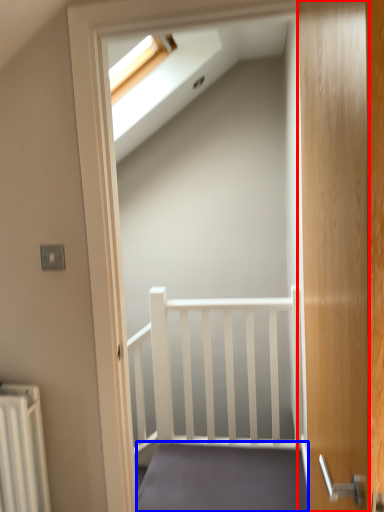
Question: Which object appears closest to the camera in this image, door (highlighted by a red box) or stairs (highlighted by a blue box)?

Choices:
 (A) door
 (B) stairs

Answer: (A)